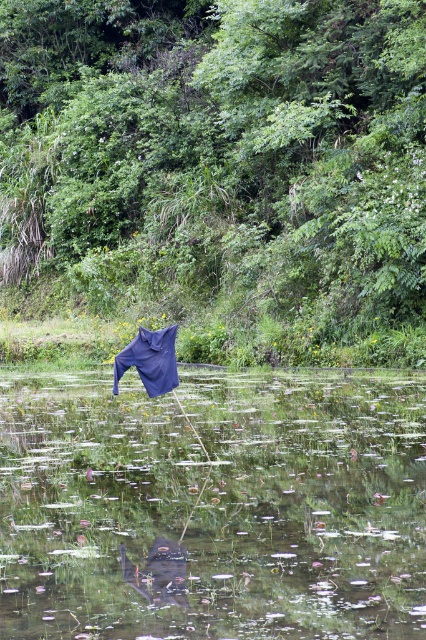
Who is positioned more to the left, dark blue fabric at center or blue fabric umbrella at center?

dark blue fabric at center

In the scene shown: Between dark blue fabric at center and blue fabric umbrella at center, which one has less height?

Standing shorter between the two is blue fabric umbrella at center.

Is point (262, 259) farther from viewer compared to point (147, 342)?

That is True.

Where is `dark blue fabric at center`? The height and width of the screenshot is (640, 426). dark blue fabric at center is located at coordinates (221, 170).

In order to click on dark blue fabric at center in this screenshot , I will do `click(221, 170)`.

Can you confirm if dark blue fabric at center is thinner than transparent plastic bag at center?

In fact, dark blue fabric at center might be wider than transparent plastic bag at center.

Is point (114, 33) positioned in front of point (201, 545)?

No, (114, 33) is behind (201, 545).

Image resolution: width=426 pixels, height=640 pixels. What are the coordinates of `dark blue fabric at center` in the screenshot? It's located at (221, 170).

Between transparent plastic bag at center and blue fabric umbrella at center, which one appears on the right side from the viewer's perspective?

transparent plastic bag at center is more to the right.

Looking at this image, can you confirm if transparent plastic bag at center is wider than blue fabric umbrella at center?

Correct, the width of transparent plastic bag at center exceeds that of blue fabric umbrella at center.

Is point (290, 442) positioned in front of point (134, 353)?

No, (290, 442) is behind (134, 353).

Identify the location of transparent plastic bag at center. (213, 506).